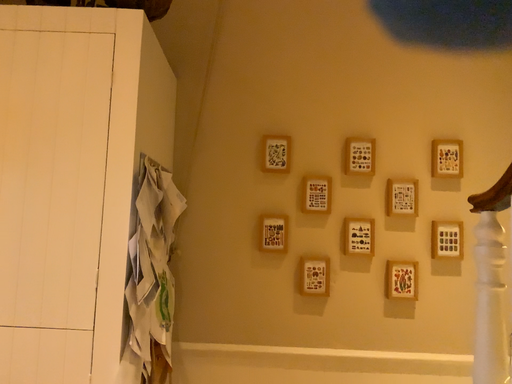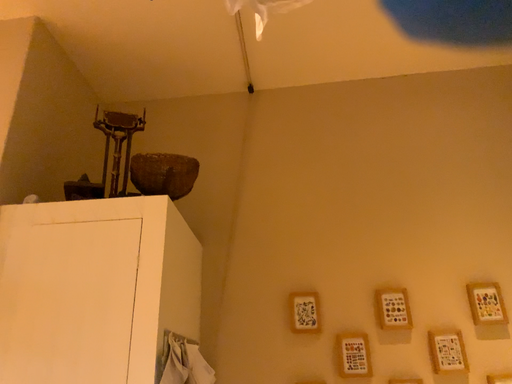
Question: How did the camera likely rotate when shooting the video?

Choices:
 (A) rotated downward
 (B) rotated upward

Answer: (B)